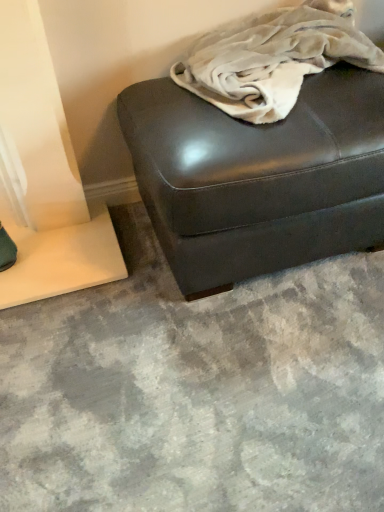
Question: In terms of size, does white cotton blanket at center appear bigger or smaller than shiny dark brown ottoman at center?

Choices:
 (A) big
 (B) small

Answer: (B)

Question: From the image's perspective, is white cotton blanket at center positioned above or below shiny dark brown ottoman at center?

Choices:
 (A) below
 (B) above

Answer: (B)

Question: Is white cotton blanket at center wider or thinner than shiny dark brown ottoman at center?

Choices:
 (A) wide
 (B) thin

Answer: (B)

Question: Is shiny dark brown ottoman at center bigger or smaller than white cotton blanket at center?

Choices:
 (A) small
 (B) big

Answer: (B)

Question: In the image, is shiny dark brown ottoman at center on the left side or the right side of white cotton blanket at center?

Choices:
 (A) right
 (B) left

Answer: (B)

Question: Considering the positions of shiny dark brown ottoman at center and white cotton blanket at center in the image, is shiny dark brown ottoman at center taller or shorter than white cotton blanket at center?

Choices:
 (A) tall
 (B) short

Answer: (A)

Question: Is shiny dark brown ottoman at center inside the boundaries of white cotton blanket at center, or outside?

Choices:
 (A) inside
 (B) outside

Answer: (B)